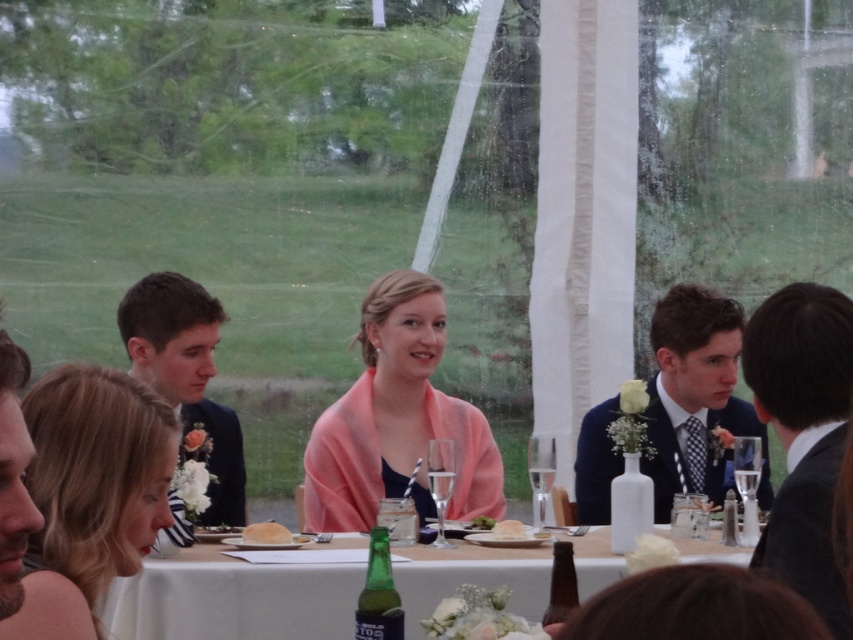
Can you confirm if blonde hair at center is wider than pink fabric shawl at center?

No.

Does point (172, 460) come farther from viewer compared to point (415, 406)?

That is False.

Which is in front, point (68, 420) or point (474, 464)?

Point (68, 420) is in front.

Identify the location of blonde hair at center. (90, 493).

Looking at this image, who is lower down, dark gray suit at right or blue suit at center?

blue suit at center is below.

Between dark gray suit at right and blue suit at center, which one appears on the left side from the viewer's perspective?

From the viewer's perspective, dark gray suit at right appears more on the left side.

Who is more forward, (814, 486) or (711, 484)?

Positioned in front is point (814, 486).

This screenshot has width=853, height=640. I want to click on dark gray suit at right, so click(x=804, y=435).

Looking at this image, is pink fabric shawl at center wider than blue suit at center?

No.

The height and width of the screenshot is (640, 853). Describe the element at coordinates (397, 419) in the screenshot. I see `pink fabric shawl at center` at that location.

Where is `pink fabric shawl at center`? pink fabric shawl at center is located at coordinates (397, 419).